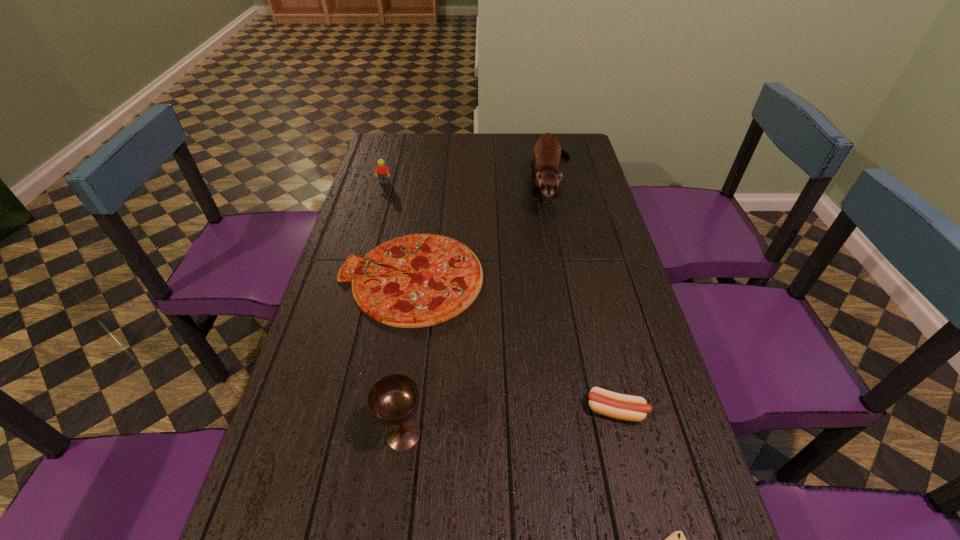
Locate which object ranks in proximity to the Lego. Please provide its 2D coordinates. Your answer should be formatted as a tuple, i.e. [(x, y)], where the tuple contains the x and y coordinates of a point satisfying the conditions above.

[(444, 277)]

Locate an element on the screen. free location that satisfies the following two spatial constraints: 1. on the face of the third tallest object; 2. on the right side of the third shortest object is located at coordinates (322, 410).

Find the location of a particular element. The image size is (960, 540). free space that satisfies the following two spatial constraints: 1. at the face of the sausage; 2. on the right side of the ferret is located at coordinates (598, 410).

In order to click on free space that satisfies the following two spatial constraints: 1. on the face of the fourth shortest object; 2. on the left side of the sausage in this screenshot , I will do `click(322, 410)`.